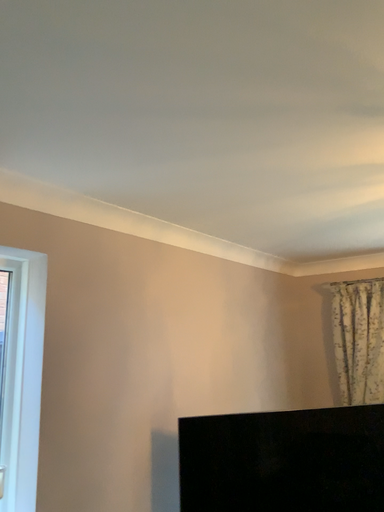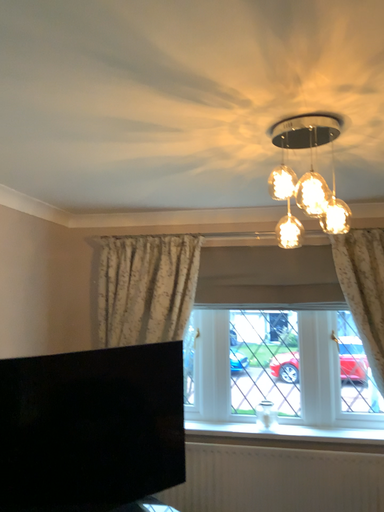
Question: How did the camera likely rotate when shooting the video?

Choices:
 (A) rotated left
 (B) rotated right

Answer: (B)